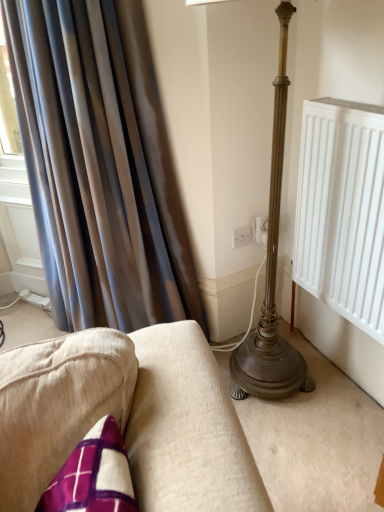
Question: Is silky brown curtain at left at the back of white plastic electric outlet at center, which is the first electric outlet in left-to-right order?

Choices:
 (A) no
 (B) yes

Answer: (A)

Question: Is white plastic electric outlet at center, which is the first electric outlet in left-to-right order, outside silky brown curtain at left?

Choices:
 (A) yes
 (B) no

Answer: (A)

Question: Is white plastic electric outlet at center, which is the first electric outlet in left-to-right order, positioned before silky brown curtain at left?

Choices:
 (A) yes
 (B) no

Answer: (B)

Question: From the image's perspective, does white plastic electric outlet at center, which is counted as the second electric outlet, starting from the right, appear higher than silky brown curtain at left?

Choices:
 (A) no
 (B) yes

Answer: (A)

Question: Can you confirm if white plastic electric outlet at center, which is the first electric outlet in left-to-right order, is bigger than silky brown curtain at left?

Choices:
 (A) yes
 (B) no

Answer: (B)

Question: Considering the positions of white plastic socket at center, arranged as the second electric outlet when viewed from the left, and white plastic electric outlet at center, which is the first electric outlet in left-to-right order, in the image, is white plastic socket at center, arranged as the second electric outlet when viewed from the left, bigger or smaller than white plastic electric outlet at center, which is the first electric outlet in left-to-right order,?

Choices:
 (A) big
 (B) small

Answer: (A)

Question: Is white plastic socket at center, which is the 1th electric outlet from right to left, wider or thinner than white plastic electric outlet at center, which is counted as the second electric outlet, starting from the right?

Choices:
 (A) thin
 (B) wide

Answer: (B)

Question: Visually, is white plastic socket at center, which is the 1th electric outlet from right to left, positioned to the left or to the right of white plastic electric outlet at center, which is counted as the second electric outlet, starting from the right?

Choices:
 (A) left
 (B) right

Answer: (B)

Question: Is white plastic socket at center, which is the 1th electric outlet from right to left, in front of or behind white plastic electric outlet at center, which is counted as the second electric outlet, starting from the right, in the image?

Choices:
 (A) front
 (B) behind

Answer: (A)

Question: Is silky brown curtain at left taller or shorter than white plastic electric outlet at center, which is the first electric outlet in left-to-right order?

Choices:
 (A) tall
 (B) short

Answer: (A)

Question: From a real-world perspective, is silky brown curtain at left above or below white plastic electric outlet at center, which is counted as the second electric outlet, starting from the right?

Choices:
 (A) below
 (B) above

Answer: (B)

Question: Choose the correct answer: Is silky brown curtain at left inside white plastic electric outlet at center, which is the first electric outlet in left-to-right order, or outside it?

Choices:
 (A) inside
 (B) outside

Answer: (B)

Question: Does point (59, 203) appear closer or farther from the camera than point (236, 236)?

Choices:
 (A) closer
 (B) farther

Answer: (A)

Question: From a real-world perspective, is white plastic electric outlet at center, which is counted as the second electric outlet, starting from the right, above or below silky brown curtain at left?

Choices:
 (A) below
 (B) above

Answer: (A)

Question: Looking at their shapes, would you say white plastic electric outlet at center, which is the first electric outlet in left-to-right order, is wider or thinner than silky brown curtain at left?

Choices:
 (A) thin
 (B) wide

Answer: (A)